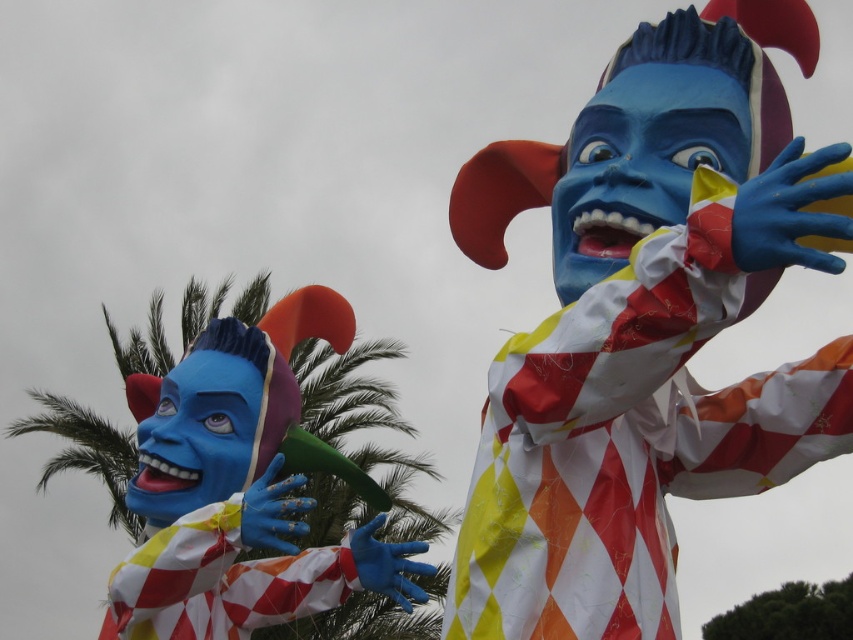
You are a photographer standing at the center of the scene. You need to take a photo that includes both the harlequin costume at center and the matte paper clown at left. Given that your camera has a maximum focus range of 30 feet, will you be able to capture both subjects clearly in the same frame?

The distance between the harlequin costume at center and the matte paper clown at left is 30.34 feet. Since your camera can only focus up to 30 feet, the subjects are slightly beyond the maximum range. Therefore, you won

Looking at this image, you are an event planner setting up for a parade. You have two clowns to place on a float. The float has a platform that can only support a maximum height of 2 meters. The harlequin costume at center is taller than the matte paper clown at left. Given that the platform is already at 1.5 meters, can both clowns be placed on the platform without exceeding the height limit?

The harlequin costume at center is taller than the matte paper clown at left. If the platform is already at 1.5 meters, adding the taller harlequin costume at center would exceed the 2 meter limit. Therefore, only the matte paper clown at left can be placed on the platform without exceeding the height limit.

You are a photographer trying to capture both the harlequin costume at center and the matte paper clown at left in a single shot. Which one should you focus on first to ensure both are in frame?

The harlequin costume at center is in front of the matte paper clown at left, so focusing on the harlequin costume at center first will help ensure both are in frame.